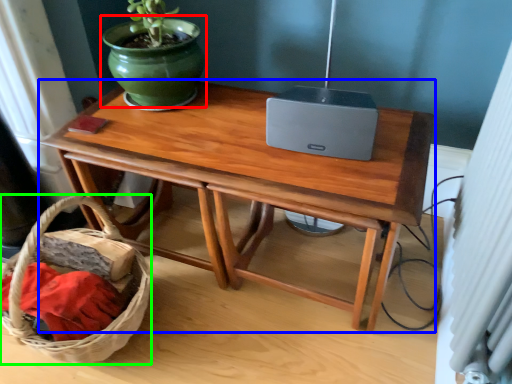
Question: Considering the real-world distances, which object is farthest from flowerpot (highlighted by a red box)? table (highlighted by a blue box) or basket (highlighted by a green box)?

Choices:
 (A) table
 (B) basket

Answer: (B)